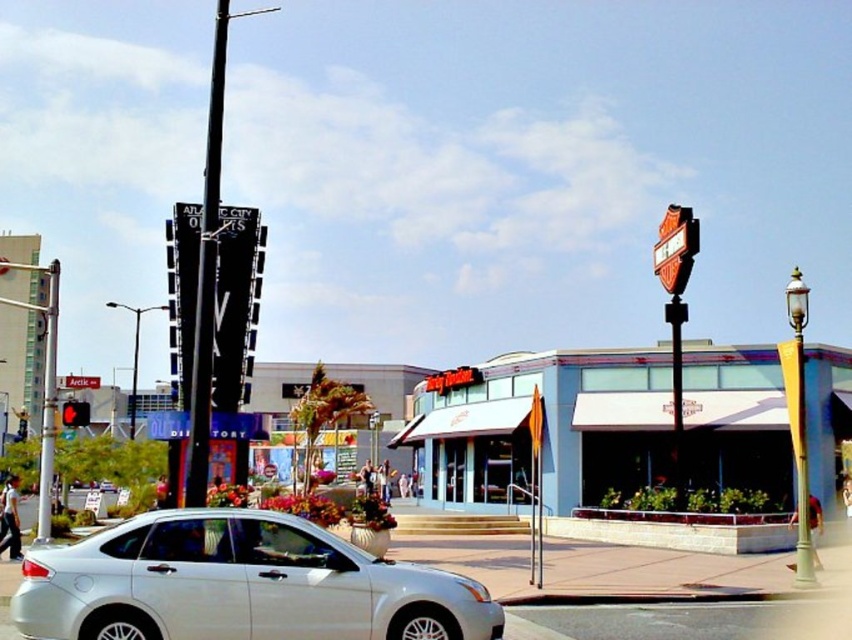
Looking at this image, you are a delivery person trying to park your 1.8 meters tall delivery box in this scene. You see the white glossy sedan at lower left and the red glass traffic light at left. Which object is taller and can the delivery box fit vertically between them?

The white glossy sedan at lower left is taller than the red glass traffic light at left. Since the delivery box is 1.8 meters tall, it can fit vertically between them as the sedan is taller than the traffic light, providing enough space.